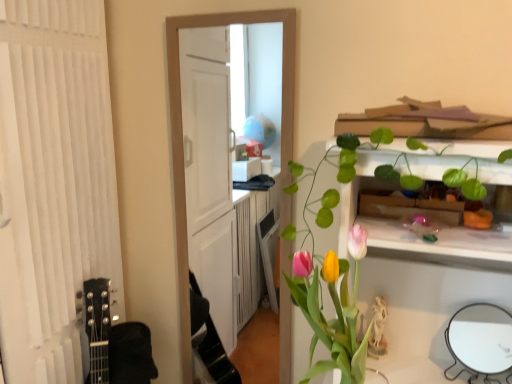
Question: Is point (509, 329) positioned closer to the camera than point (345, 337)?

Choices:
 (A) farther
 (B) closer

Answer: (A)

Question: Looking at the image, does white glossy mirror at lower right seem bigger or smaller compared to matte plastic vase with tulips at center?

Choices:
 (A) big
 (B) small

Answer: (B)

Question: Is white glossy mirror at lower right inside or outside of matte plastic vase with tulips at center?

Choices:
 (A) outside
 (B) inside

Answer: (A)

Question: From a real-world perspective, is matte plastic vase with tulips at center positioned above or below white glossy mirror at lower right?

Choices:
 (A) below
 (B) above

Answer: (B)

Question: From the image's perspective, is matte plastic vase with tulips at center above or below white glossy mirror at lower right?

Choices:
 (A) below
 (B) above

Answer: (B)

Question: Which is correct: matte plastic vase with tulips at center is inside white glossy mirror at lower right, or outside of it?

Choices:
 (A) outside
 (B) inside

Answer: (A)

Question: Looking at the image, does matte plastic vase with tulips at center seem bigger or smaller compared to white glossy mirror at lower right?

Choices:
 (A) small
 (B) big

Answer: (B)